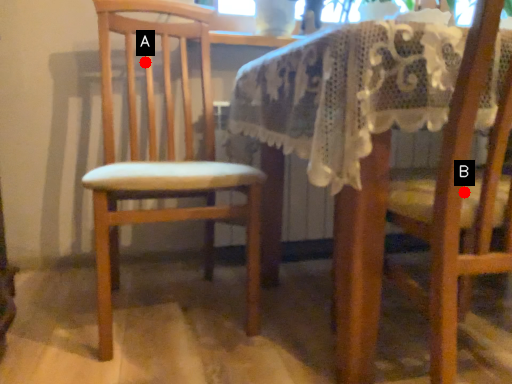
Question: Two points are circled on the image, labeled by A and B beside each circle. Which point is closer to the camera taking this photo?

Choices:
 (A) A is closer
 (B) B is closer

Answer: (B)